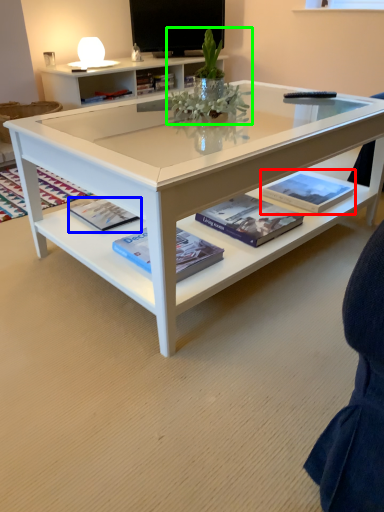
Question: Estimate the real-world distances between objects in this image. Which object is farther from book (highlighted by a red box), paperback book (highlighted by a blue box) or floral arrangement (highlighted by a green box)?

Choices:
 (A) paperback book
 (B) floral arrangement

Answer: (A)